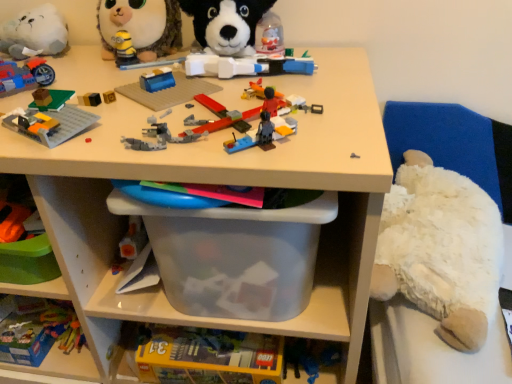
Question: Can you confirm if translucent plastic baseplate at upper left, the fifth toy from the right, is positioned to the right of white plush cat at upper left, acting as the 2th toy starting from the left?

Choices:
 (A) yes
 (B) no

Answer: (A)

Question: Could you tell me if translucent plastic baseplate at upper left, the fifth toy from the right, is turned towards white plush cat at upper left, acting as the 2th toy starting from the left?

Choices:
 (A) yes
 (B) no

Answer: (B)

Question: From a real-world perspective, does translucent plastic baseplate at upper left, the fifth toy from the right, stand above white plush cat at upper left, the seventh toy viewed from the right?

Choices:
 (A) yes
 (B) no

Answer: (B)

Question: Can you confirm if translucent plastic baseplate at upper left, the fifth toy from the right, is positioned to the left of white plush cat at upper left, acting as the 2th toy starting from the left?

Choices:
 (A) yes
 (B) no

Answer: (B)

Question: Can white plush cat at upper left, the seventh toy viewed from the right, be found inside translucent plastic baseplate at upper left, which is the fourth toy in left-to-right order?

Choices:
 (A) no
 (B) yes

Answer: (A)

Question: In terms of width, does translucent plastic lego box at lower left, the 8th toy positioned from the right, look wider or thinner when compared to translucent plastic airplane at center, arranged as the 3th toy when viewed from the right?

Choices:
 (A) thin
 (B) wide

Answer: (A)

Question: Looking at the image, does translucent plastic lego box at lower left, the 8th toy positioned from the right, seem bigger or smaller compared to translucent plastic airplane at center, which is the 6th toy from left to right?

Choices:
 (A) big
 (B) small

Answer: (A)

Question: Is point (5, 324) positioned closer to the camera than point (206, 107)?

Choices:
 (A) farther
 (B) closer

Answer: (A)

Question: Is translucent plastic lego box at lower left, the first toy when ordered from left to right, in front of or behind translucent plastic airplane at center, arranged as the 3th toy when viewed from the right, in the image?

Choices:
 (A) behind
 (B) front

Answer: (A)

Question: From a real-world perspective, is white plush cat at upper left, the seventh toy viewed from the right, physically located above or below white plush at right?

Choices:
 (A) above
 (B) below

Answer: (A)

Question: From the image's perspective, is white plush cat at upper left, the seventh toy viewed from the right, positioned above or below white plush at right?

Choices:
 (A) above
 (B) below

Answer: (A)

Question: Would you say white plush cat at upper left, the seventh toy viewed from the right, is to the left or to the right of white plush at right in the picture?

Choices:
 (A) left
 (B) right

Answer: (A)

Question: In terms of width, does white plush cat at upper left, the seventh toy viewed from the right, look wider or thinner when compared to white plush at right?

Choices:
 (A) wide
 (B) thin

Answer: (A)

Question: Is matte blue motorcycle at upper left, the 3th toy positioned from the left, inside the boundaries of translucent plastic baseplate at upper left, which is the fourth toy in left-to-right order, or outside?

Choices:
 (A) outside
 (B) inside

Answer: (A)

Question: Considering the positions of matte blue motorcycle at upper left, arranged as the sixth toy when viewed from the right, and translucent plastic baseplate at upper left, the fifth toy from the right, in the image, is matte blue motorcycle at upper left, arranged as the sixth toy when viewed from the right, taller or shorter than translucent plastic baseplate at upper left, the fifth toy from the right,?

Choices:
 (A) short
 (B) tall

Answer: (B)